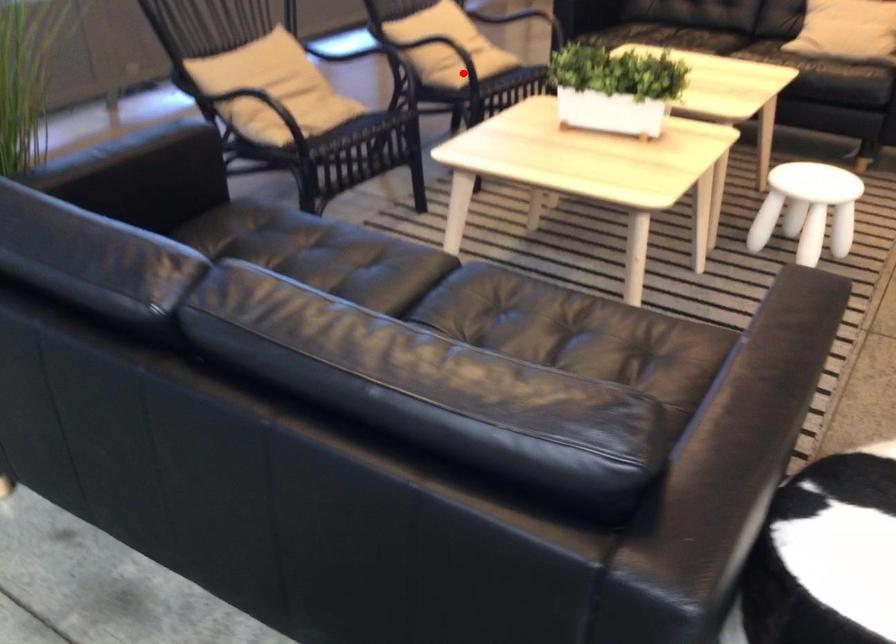
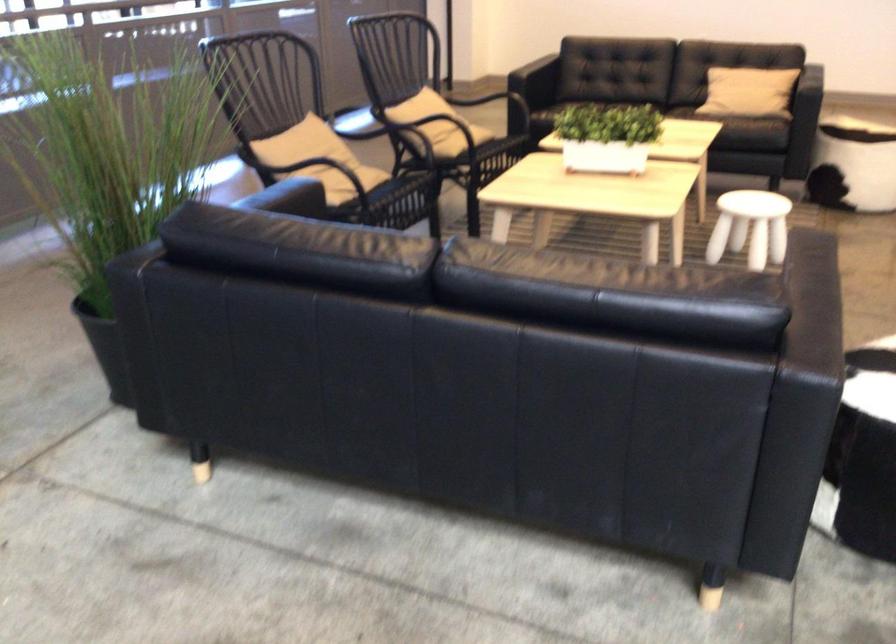
Locate, in the second image, the point that corresponds to the highlighted location in the first image.

(462, 140)